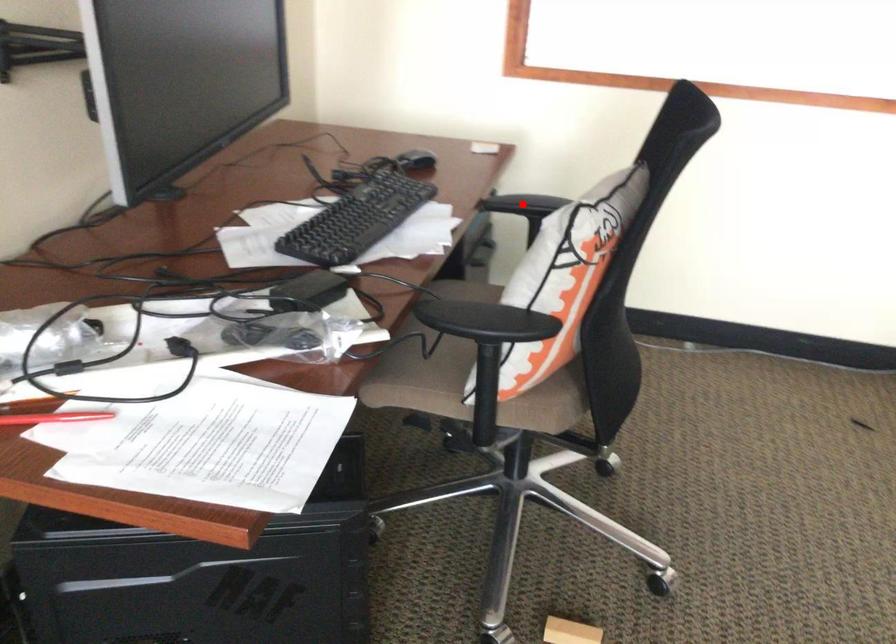
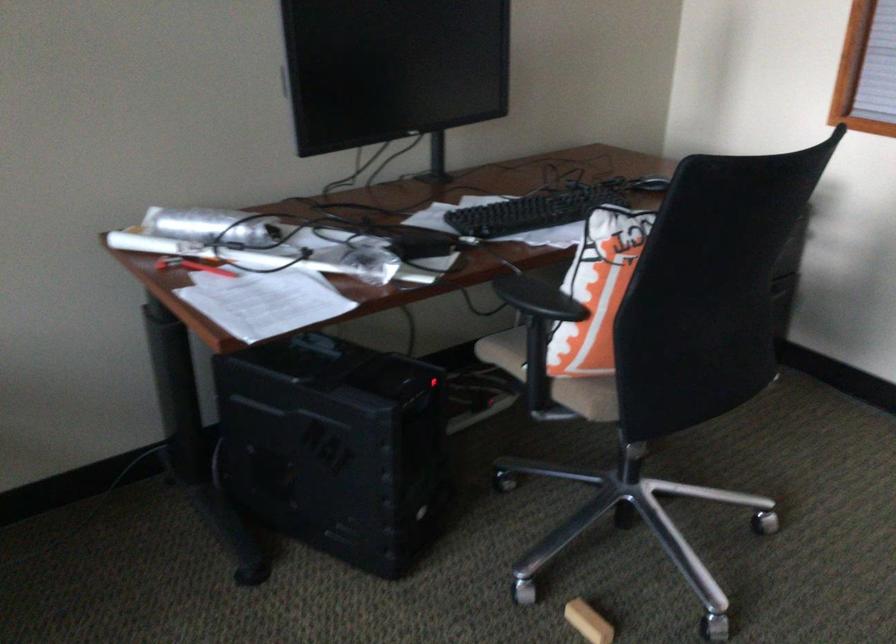
Question: I am providing you with two images of the same scene from different viewpoints. A red point is marked on the first image. Can you still see the location of the red point in image 2?

Choices:
 (A) Yes
 (B) No

Answer: (B)